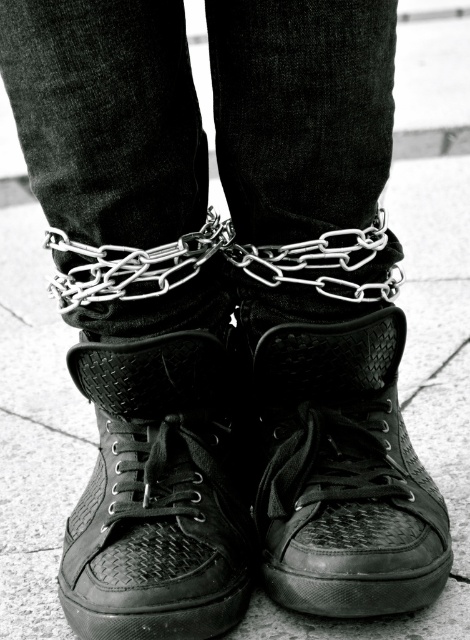
Question: Which point is farther to the camera?

Choices:
 (A) black woven fabric shoe at center
 (B) metallic chain at center

Answer: (B)

Question: Is black woven fabric shoe at center further to the viewer compared to metallic chain at center?

Choices:
 (A) no
 (B) yes

Answer: (A)

Question: Which object is farther from the camera taking this photo?

Choices:
 (A) matte black sneaker at center
 (B) black woven fabric shoe at center

Answer: (A)

Question: Estimate the real-world distances between objects in this image. Which object is closer to the black woven fabric shoe at center?

Choices:
 (A) matte black sneaker at center
 (B) metallic chain at center

Answer: (A)

Question: Can you confirm if matte black sneaker at center is smaller than metallic chain at center?

Choices:
 (A) yes
 (B) no

Answer: (B)

Question: Considering the relative positions of matte black sneaker at center and metallic chain at center in the image provided, where is matte black sneaker at center located with respect to metallic chain at center?

Choices:
 (A) below
 (B) above

Answer: (A)